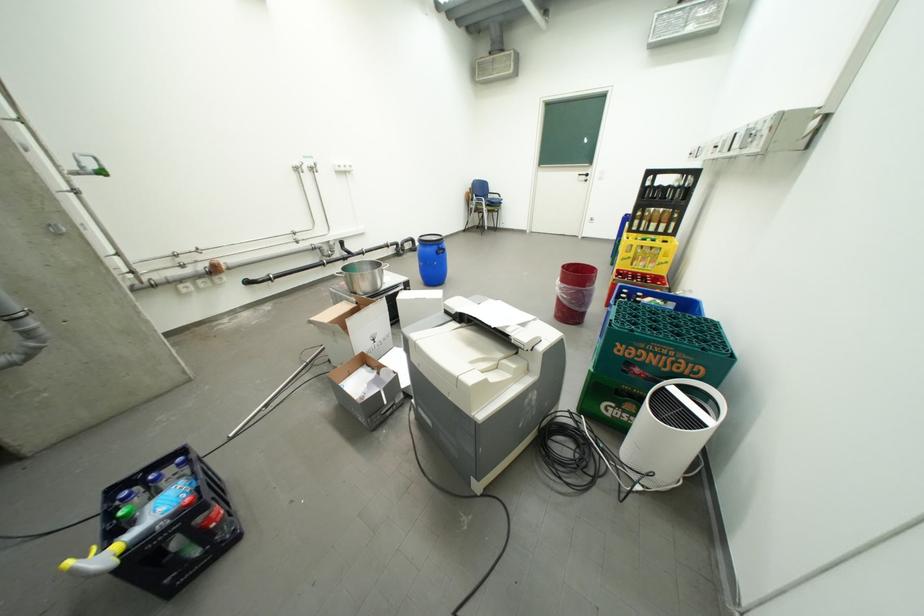
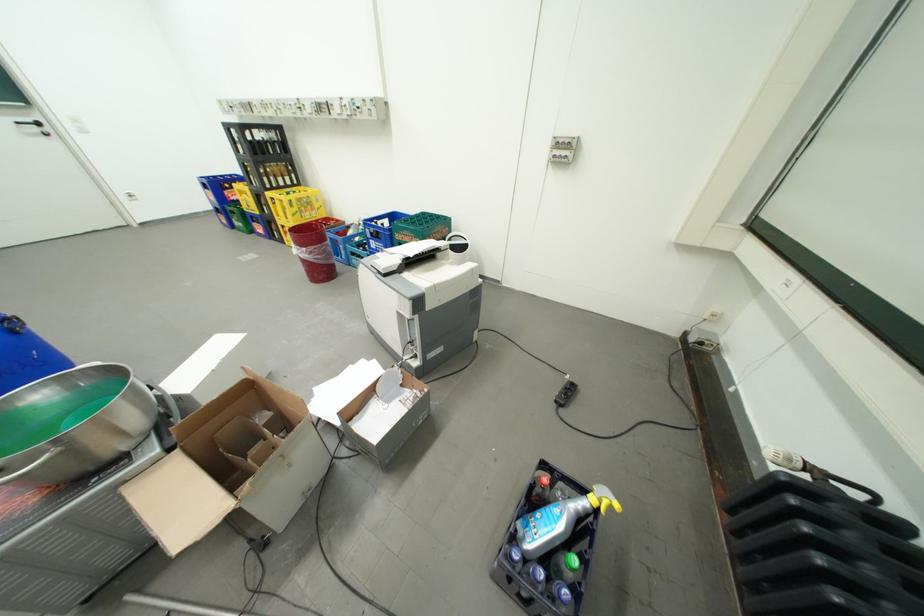
Where in the second image is the point corresponding to point 596,175 from the first image?

(41, 122)